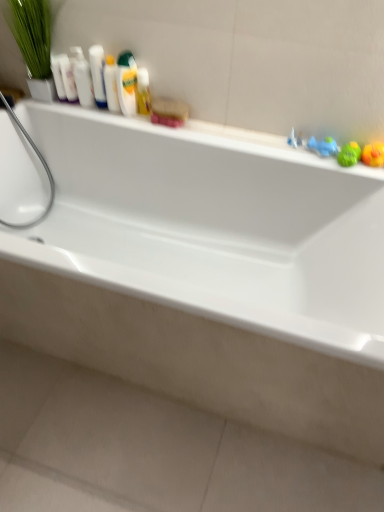
This screenshot has height=512, width=384. What do you see at coordinates (373, 154) in the screenshot? I see `yellow rubber duck at upper right, the first toy when ordered from right to left` at bounding box center [373, 154].

Describe the element at coordinates (111, 84) in the screenshot. I see `translucent plastic mouthwash at upper left, which is counted as the 4th mouthwash, starting from the left` at that location.

Measure the distance between point [27,55] and camera.

5.07 feet.

In order to face green rubber duck at right, which is the 2th toy from left to right, should I rotate leftwards or rightwards?

Rotate your view right by about 20.154°.

The height and width of the screenshot is (512, 384). What do you see at coordinates (349, 154) in the screenshot?
I see `green rubber duck at right, placed as the 2th toy when sorted from right to left` at bounding box center [349, 154].

Describe the element at coordinates (98, 74) in the screenshot. Image resolution: width=384 pixels, height=512 pixels. I see `white glossy bottles at upper left` at that location.

The height and width of the screenshot is (512, 384). What are the coordinates of `yellow rubber duck at upper right, which appears as the third toy when viewed from the left` in the screenshot? It's located at (373, 154).

Which is more to the left, white glossy mouthwash at upper left, acting as the fourth mouthwash starting from the right, or white glossy ledge at upper center?

white glossy mouthwash at upper left, acting as the fourth mouthwash starting from the right, is more to the left.

Is white glossy mouthwash at upper left, acting as the fourth mouthwash starting from the right, oriented away from white glossy ledge at upper center?

No, white glossy ledge at upper center is not at the back of white glossy mouthwash at upper left, acting as the fourth mouthwash starting from the right.

Considering the sizes of white glossy mouthwash at upper left, acting as the fourth mouthwash starting from the right, and white glossy ledge at upper center in the image, is white glossy mouthwash at upper left, acting as the fourth mouthwash starting from the right, wider or thinner than white glossy ledge at upper center?

In the image, white glossy mouthwash at upper left, acting as the fourth mouthwash starting from the right, appears to be wider than white glossy ledge at upper center.

Locate an element on the screen. Image resolution: width=384 pixels, height=512 pixels. the 2nd mouthwash behind when counting from the white glossy ledge at upper center is located at coordinates [82, 77].

From the image's perspective, who appears lower, white plastic faucet at upper right or white glossy mouthwash at upper left, arranged as the first mouthwash when viewed from the left?

white plastic faucet at upper right.

Is white plastic faucet at upper right facing towards white glossy mouthwash at upper left, which ranks as the sixth mouthwash in right-to-left order?

No, white plastic faucet at upper right is not oriented towards white glossy mouthwash at upper left, which ranks as the sixth mouthwash in right-to-left order.

This screenshot has height=512, width=384. I want to click on faucet in front of the white glossy mouthwash at upper left, arranged as the first mouthwash when viewed from the left, so click(x=295, y=140).

Which of these two, white plastic faucet at upper right or white glossy mouthwash at upper left, arranged as the first mouthwash when viewed from the left, is thinner?

white plastic faucet at upper right is thinner.

Identify the location of the 4th mouthwash positioned below the translucent plastic mouthwash at upper center, marked as the 2th mouthwash in a right-to-left arrangement (from a real-world perspective). The image size is (384, 512). (143, 92).

Can we say translucent plastic mouthwash at upper center, marked as the 2th mouthwash in a right-to-left arrangement, lies outside translucent plastic mouthwash at upper center, placed as the 6th mouthwash when sorted from left to right?

Yes.

From the image's perspective, which is above, translucent plastic mouthwash at upper center, marked as the 2th mouthwash in a right-to-left arrangement, or translucent plastic mouthwash at upper center, placed as the 6th mouthwash when sorted from left to right?

translucent plastic mouthwash at upper center, marked as the 2th mouthwash in a right-to-left arrangement, is shown above in the image.

Is white glossy bathtub at center turned away from white glossy bottles at upper left?

That's not correct — white glossy bathtub at center is not looking away from white glossy bottles at upper left.

Does white glossy bathtub at center lie behind white glossy bottles at upper left?

No, it is in front of white glossy bottles at upper left.

From a real-world perspective, is white glossy bathtub at center on top of white glossy bottles at upper left?

No, from a real-world perspective, white glossy bathtub at center is not on top of white glossy bottles at upper left.

Would you say white glossy ledge at upper center is a long distance from white glossy mouthwash at upper left, the second mouthwash viewed from the left?

No, white glossy ledge at upper center is not far away from white glossy mouthwash at upper left, the second mouthwash viewed from the left.

From the image's perspective, which object appears higher, white glossy ledge at upper center or white glossy mouthwash at upper left, the 5th mouthwash in the right-to-left sequence?

white glossy mouthwash at upper left, the 5th mouthwash in the right-to-left sequence, from the image's perspective.

Is white glossy ledge at upper center aimed at white glossy mouthwash at upper left, the second mouthwash viewed from the left?

No, white glossy ledge at upper center is not oriented towards white glossy mouthwash at upper left, the second mouthwash viewed from the left.

From the image's perspective, who appears lower, white glossy mouthwash at upper left, the third mouthwash when ordered from left to right, or white glossy bathtub at center?

white glossy bathtub at center appears lower in the image.

From the picture: From a real-world perspective, who is located lower, white glossy mouthwash at upper left, acting as the fourth mouthwash starting from the right, or white glossy bathtub at center?

white glossy bathtub at center.

In the image, is white glossy mouthwash at upper left, the third mouthwash when ordered from left to right, positioned in front of or behind white glossy bathtub at center?

In the image, white glossy mouthwash at upper left, the third mouthwash when ordered from left to right, appears behind white glossy bathtub at center.

Is white glossy mouthwash at upper left, the third mouthwash when ordered from left to right, outside of white glossy bathtub at center?

Indeed, white glossy mouthwash at upper left, the third mouthwash when ordered from left to right, is completely outside white glossy bathtub at center.

How distant is translucent plastic mouthwash at upper center, placed as the 6th mouthwash when sorted from left to right, from translucent plastic mouthwash at upper center, marked as the 2th mouthwash in a right-to-left arrangement?

The distance of translucent plastic mouthwash at upper center, placed as the 6th mouthwash when sorted from left to right, from translucent plastic mouthwash at upper center, marked as the 2th mouthwash in a right-to-left arrangement, is 1.77 inches.

From a real-world perspective, which mouthwash is the 4th one underneath the translucent plastic mouthwash at upper center, marked as the 2th mouthwash in a right-to-left arrangement? Please provide its 2D coordinates.

[(143, 92)]

Could translucent plastic mouthwash at upper center, the fifth mouthwash when ordered from left to right, be considered to be inside translucent plastic mouthwash at upper center, placed as the 6th mouthwash when sorted from left to right?

No, translucent plastic mouthwash at upper center, the fifth mouthwash when ordered from left to right, is not a part of translucent plastic mouthwash at upper center, placed as the 6th mouthwash when sorted from left to right.

From the image's perspective, is translucent plastic mouthwash at upper center, placed as the 6th mouthwash when sorted from left to right, located above or below translucent plastic mouthwash at upper center, the fifth mouthwash when ordered from left to right?

translucent plastic mouthwash at upper center, placed as the 6th mouthwash when sorted from left to right, is below translucent plastic mouthwash at upper center, the fifth mouthwash when ordered from left to right.

Where is `ledge that is on the right side of white glossy mouthwash at upper left, acting as the fourth mouthwash starting from the right`? ledge that is on the right side of white glossy mouthwash at upper left, acting as the fourth mouthwash starting from the right is located at coordinates (202, 135).

Locate an element on the screen. This screenshot has height=512, width=384. the 6th mouthwash positioned above the white plastic faucet at upper right (from the image's perspective) is located at coordinates (58, 77).

Considering their positions, is yellow rubber duck at upper right, the first toy when ordered from right to left, positioned closer to blue rubber duck at upper right, the 3th toy viewed from the right, than green leafy plant at upper left?

yellow rubber duck at upper right, the first toy when ordered from right to left, lies closer to blue rubber duck at upper right, the 3th toy viewed from the right, than the other object.

Considering their positions, is blue rubber duck at upper right, marked as the first toy in a left-to-right arrangement, positioned closer to white glossy bottles at upper left than white glossy mouthwash at upper left, the third mouthwash when ordered from left to right?

white glossy mouthwash at upper left, the third mouthwash when ordered from left to right.

Consider the image. Looking at the image, which one is located further to white glossy bathtub at center, green leafy plant at upper left or white glossy mouthwash at upper left, which ranks as the sixth mouthwash in right-to-left order?

Based on the image, white glossy mouthwash at upper left, which ranks as the sixth mouthwash in right-to-left order, appears to be further to white glossy bathtub at center.

Estimate the real-world distances between objects in this image. Which object is closer to white plastic faucet at upper right, blue rubber duck at upper right, marked as the first toy in a left-to-right arrangement, or translucent plastic mouthwash at upper center, the 1th mouthwash from the right?

Among the two, blue rubber duck at upper right, marked as the first toy in a left-to-right arrangement, is located nearer to white plastic faucet at upper right.

Estimate the real-world distances between objects in this image. Which object is further from translucent plastic mouthwash at upper left, which is counted as the 4th mouthwash, starting from the left, white plastic faucet at upper right or white glossy mouthwash at upper left, the second mouthwash viewed from the left?

white plastic faucet at upper right is positioned further to the anchor translucent plastic mouthwash at upper left, which is counted as the 4th mouthwash, starting from the left.

Based on their spatial positions, is white glossy bottles at upper left or blue rubber duck at upper right, marked as the first toy in a left-to-right arrangement, closer to white glossy bathtub at center?

Among the two, blue rubber duck at upper right, marked as the first toy in a left-to-right arrangement, is located nearer to white glossy bathtub at center.

Estimate the real-world distances between objects in this image. Which object is closer to white glossy bathtub at center, translucent plastic mouthwash at upper center, marked as the 2th mouthwash in a right-to-left arrangement, or translucent plastic mouthwash at upper left, which is counted as the 4th mouthwash, starting from the left?

translucent plastic mouthwash at upper center, marked as the 2th mouthwash in a right-to-left arrangement, is closer to white glossy bathtub at center.

When comparing their distances from white glossy bathtub at center, does white glossy mouthwash at upper left, acting as the fourth mouthwash starting from the right, or white glossy mouthwash at upper left, which ranks as the sixth mouthwash in right-to-left order, seem further?

white glossy mouthwash at upper left, which ranks as the sixth mouthwash in right-to-left order, is positioned further to the anchor white glossy bathtub at center.

At what (x,y) coordinates should I click in order to perform the action: click on faucet situated between green leafy plant at upper left and blue rubber duck at upper right, marked as the first toy in a left-to-right arrangement, from left to right. Please return your answer as a coordinate pair (x, y). The image size is (384, 512). Looking at the image, I should click on (295, 140).

You are a GUI agent. You are given a task and a screenshot of the screen. Output one action in this format:
    pyautogui.click(x=<x>, y=<y>)
    Task: Click on the ledge situated between translucent plastic mouthwash at upper center, placed as the 6th mouthwash when sorted from left to right, and yellow rubber duck at upper right, the first toy when ordered from right to left, from left to right
    This screenshot has width=384, height=512.
    Given the screenshot: What is the action you would take?
    pyautogui.click(x=202, y=135)

Where is `toiletry between white glossy mouthwash at upper left, arranged as the first mouthwash when viewed from the left, and white plastic faucet at upper right, in the horizontal direction`? The height and width of the screenshot is (512, 384). toiletry between white glossy mouthwash at upper left, arranged as the first mouthwash when viewed from the left, and white plastic faucet at upper right, in the horizontal direction is located at coordinates (98, 74).

Find the location of a particular element. This screenshot has width=384, height=512. faucet located between white glossy mouthwash at upper left, the third mouthwash when ordered from left to right, and yellow rubber duck at upper right, the first toy when ordered from right to left, in the left-right direction is located at coordinates (295, 140).